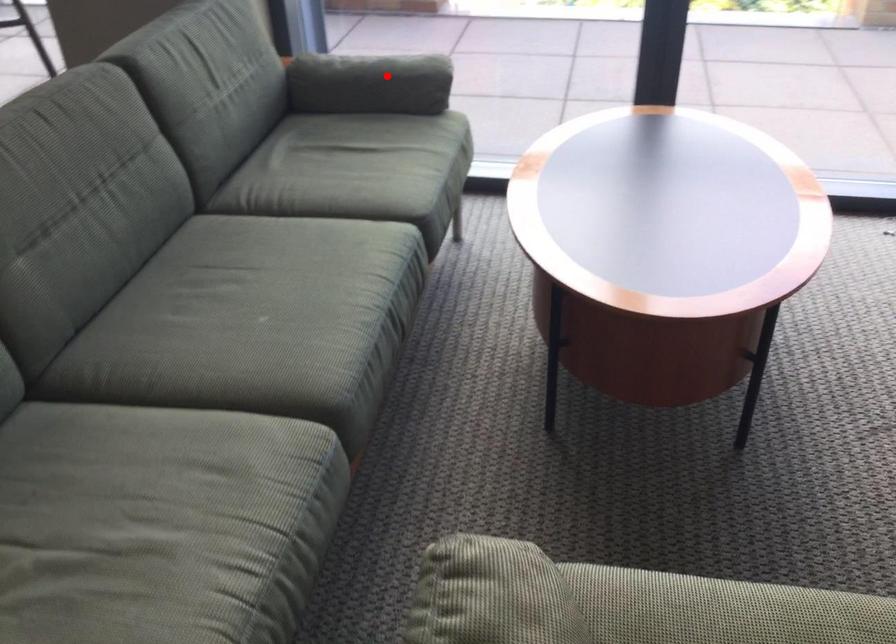
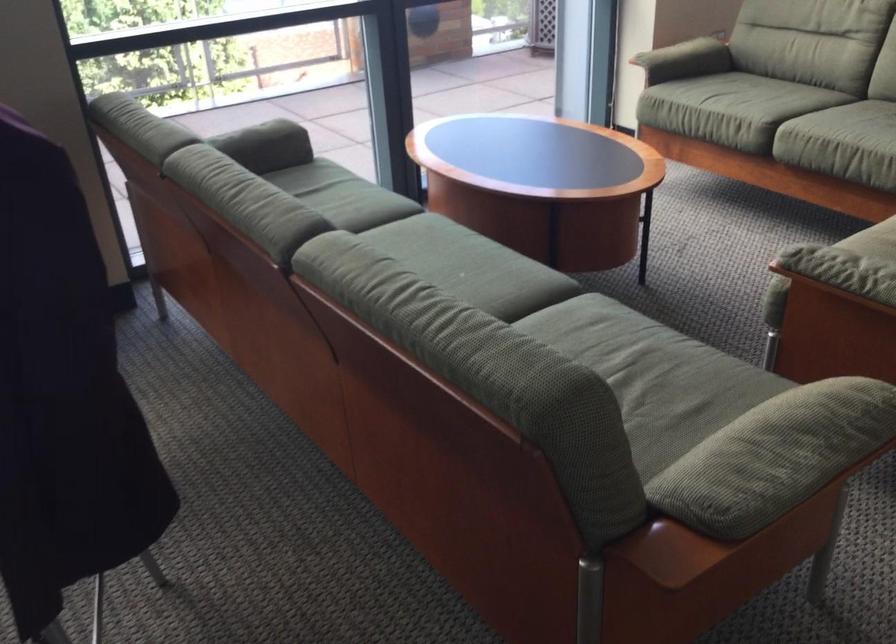
Question: I am providing you with two images of the same scene from different viewpoints. A red point is shown in image1. For the corresponding object point in image2, is it positioned nearer or farther from the camera?

Choices:
 (A) Nearer
 (B) Farther

Answer: (B)